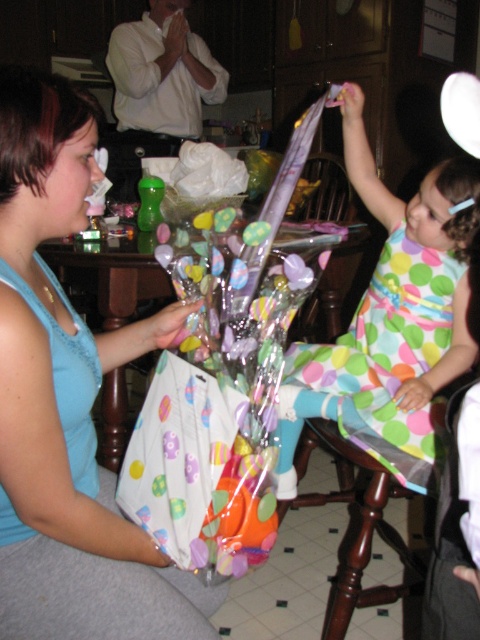
At what (x,y) coordinates should I click in order to perform the action: click on polka dot dress at center. Please return your answer as a coordinate pair (x, y). Looking at the image, I should click on (392, 321).

Identify the location of polka dot dress at center. [392, 321].

Image resolution: width=480 pixels, height=640 pixels. In order to click on polka dot dress at center in this screenshot , I will do `click(392, 321)`.

From the picture: Can you confirm if matte blue tank top at left is bigger than polka dot dress at center?

No, matte blue tank top at left is not bigger than polka dot dress at center.

Does point (192, 580) come in front of point (420, 328)?

Yes.

Is point (96, 115) less distant than point (380, 426)?

Yes, it is.

Where is `matte blue tank top at left`? matte blue tank top at left is located at coordinates (68, 401).

Describe the element at coordinates (68, 401) in the screenshot. This screenshot has width=480, height=640. I see `matte blue tank top at left` at that location.

Who is positioned more to the left, matte blue tank top at left or brown wood stool at lower center?

matte blue tank top at left is more to the left.

Does point (177, 305) lie behind point (392, 483)?

That is False.

You are a GUI agent. You are given a task and a screenshot of the screen. Output one action in this format:
    pyautogui.click(x=<x>, y=<y>)
    Task: Click on the matte blue tank top at left
    
    Given the screenshot: What is the action you would take?
    pyautogui.click(x=68, y=401)